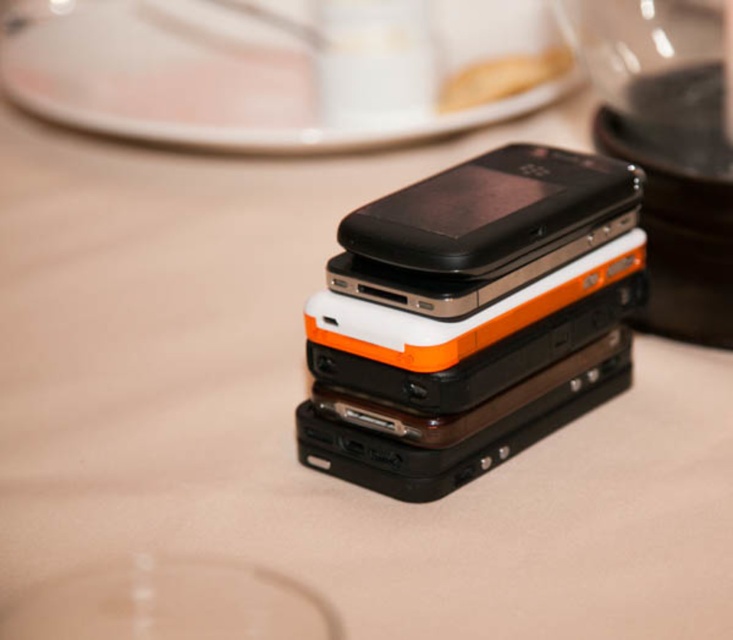
Question: Among these points, which one is nearest to the camera?

Choices:
 (A) (419, 193)
 (B) (84, 33)
 (C) (707, 316)

Answer: (A)

Question: Which is farther from the black matte smartphone at center?

Choices:
 (A) black plastic blender at upper right
 (B) white glossy plate at upper center

Answer: (B)

Question: Which point is closer to the camera?

Choices:
 (A) (647, 172)
 (B) (12, 83)

Answer: (A)

Question: Does white glossy plate at upper center appear on the right side of black matte smartphone at center?

Choices:
 (A) no
 (B) yes

Answer: (A)

Question: Does white glossy plate at upper center have a lesser width compared to black plastic blender at upper right?

Choices:
 (A) yes
 (B) no

Answer: (B)

Question: Where is white glossy plate at upper center located in relation to black plastic blender at upper right in the image?

Choices:
 (A) left
 (B) right

Answer: (A)